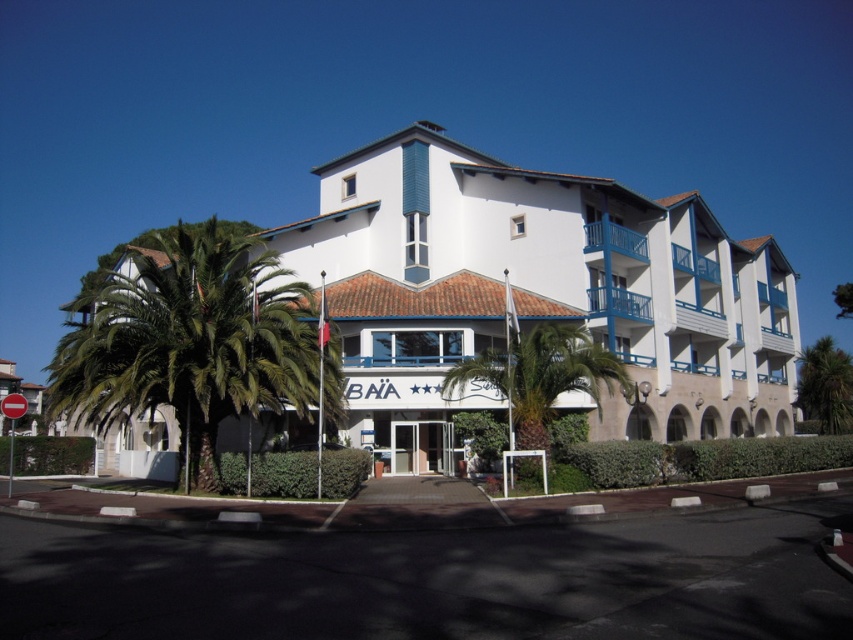
You are standing in front of the BAIA building and want to take a photo of both the green leafy palm tree at left and the green leafy palm tree at center. Which palm tree is positioned more to the left side of the image?

The green leafy palm tree at left is positioned more to the left side of the image compared to the green leafy palm tree at center.

You are a photographer standing at the front of the white matte building at center and the green leafy palm tree at center. You want to capture a wide shot that includes both subjects. Which subject will require you to step back further to include its full width in the frame?

The white matte building at center has a larger width than the green leafy palm tree at center, so you will need to step back further to include its full width in the frame.

You are standing at the point marked by coordinates point [538,291]. Looking at the scene described, what structure are you directly in front of?

The point [538,291] corresponds to the white matte building at center, so you are directly in front of the white matte building at center.